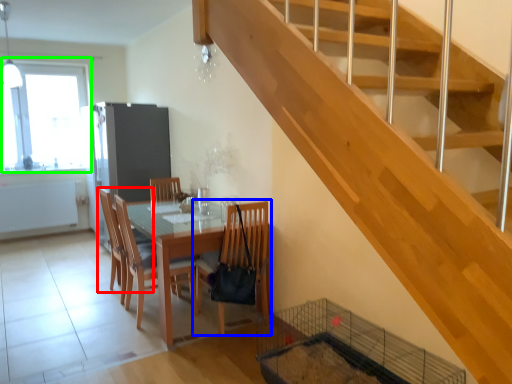
Question: Which is nearer to the chair (highlighted by a red box)? chair (highlighted by a blue box) or window (highlighted by a green box).

Choices:
 (A) chair
 (B) window

Answer: (A)